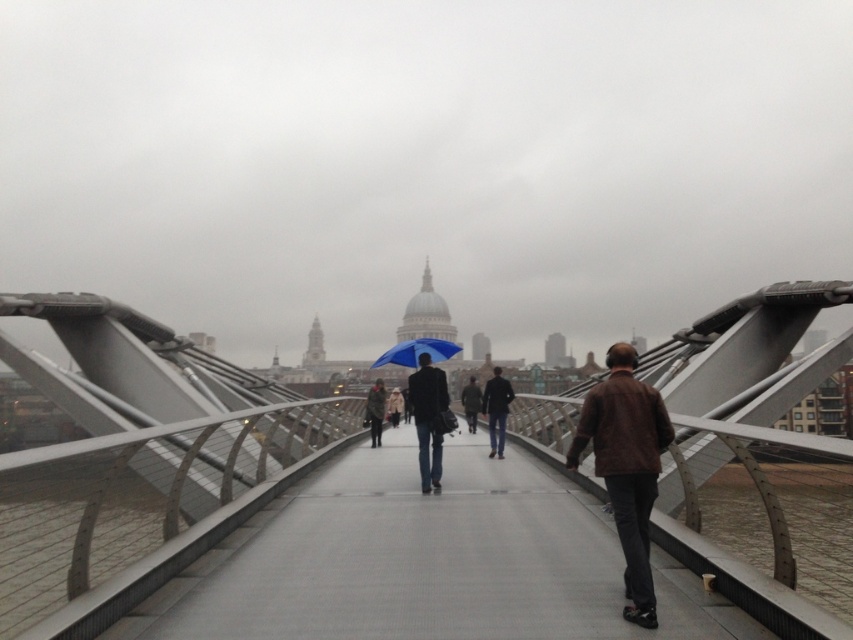
You are standing on the Millennium Bridge in London and want to reach the point marked at coordinates point (413, 348). Given that your walking speed is 3 feet per second, how many seconds will it take you to reach that point?

The point (413, 348) is 107.99 feet away from the viewer. At a walking speed of 3 feet per second, it would take approximately 36 seconds to reach the point since 107.99 divided by 3 equals approximately 36 seconds.